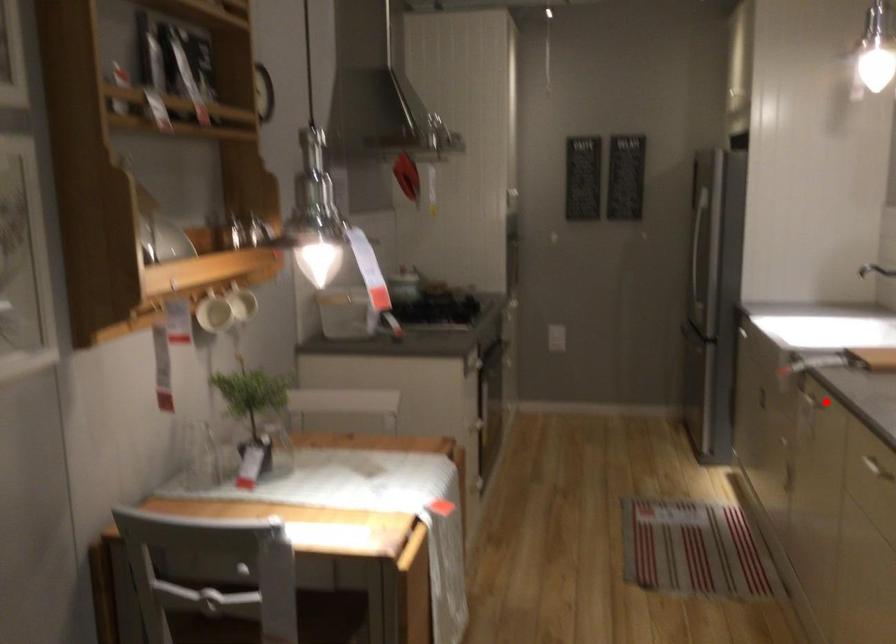
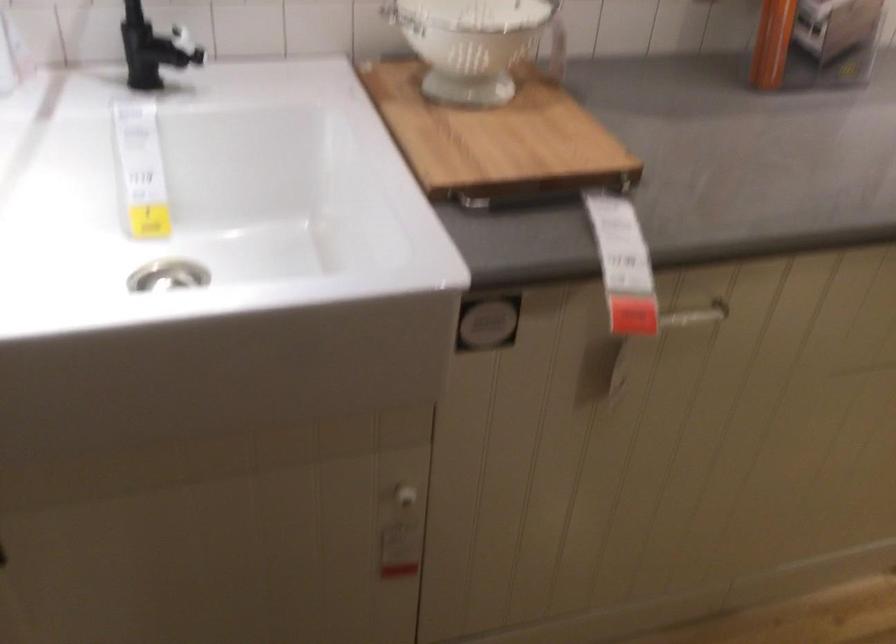
Question: I am providing you with two images of the same scene from different viewpoints. A red point is shown in image1. For the corresponding object point in image2, is it positioned nearer or farther from the camera?

Choices:
 (A) Nearer
 (B) Farther

Answer: (A)